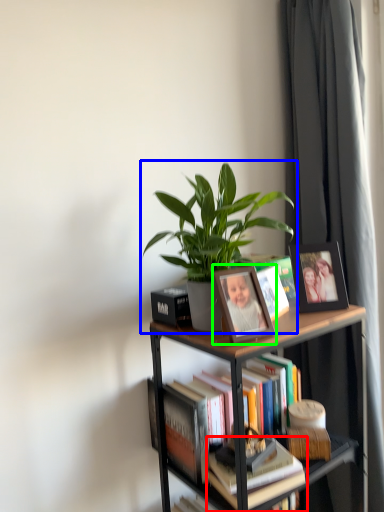
Question: Which object is the farthest from book (highlighted by a red box)? Choose among these: houseplant (highlighted by a blue box) or picture frame (highlighted by a green box).

Choices:
 (A) houseplant
 (B) picture frame

Answer: (A)